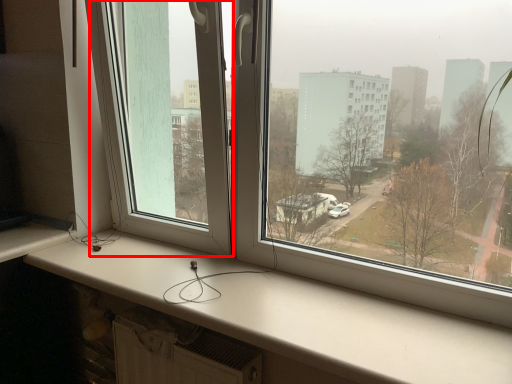
Question: From the image's perspective, considering the relative positions of window screen (annotated by the red box) and window sill in the image provided, where is window screen (annotated by the red box) located with respect to the staircase?

Choices:
 (A) above
 (B) below

Answer: (A)